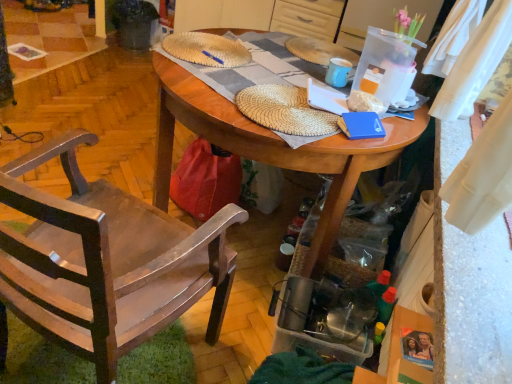
Identify the location of vacant region below woven straw hat at center, which is the second hat from back to front (from a real-world perspective). This screenshot has height=384, width=512. (281, 103).